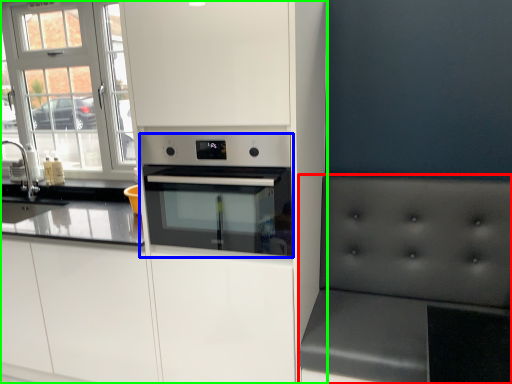
Question: Which object is the farthest from armchair (highlighted by a red box)? Choose among these: home appliance (highlighted by a blue box) or cabinetry (highlighted by a green box).

Choices:
 (A) home appliance
 (B) cabinetry

Answer: (B)